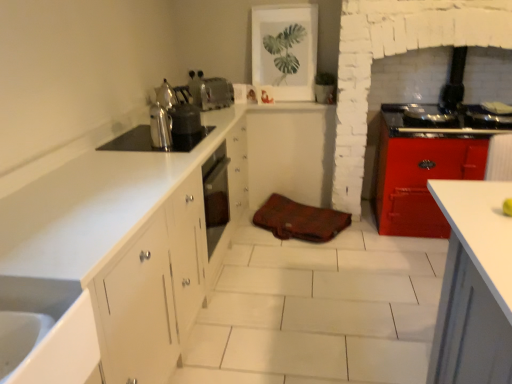
Question: Considering the positions of satin silver kettle at upper left, acting as the second appliance starting from the back, and satin silver kettle at upper left, the third appliance in the back-to-front sequence, in the image, is satin silver kettle at upper left, acting as the second appliance starting from the back, taller or shorter than satin silver kettle at upper left, the third appliance in the back-to-front sequence,?

Choices:
 (A) short
 (B) tall

Answer: (B)

Question: Looking at the image, does satin silver kettle at upper left, acting as the second appliance starting from the back, seem bigger or smaller compared to satin silver kettle at upper left, the third appliance in the back-to-front sequence?

Choices:
 (A) small
 (B) big

Answer: (B)

Question: Which of these objects is positioned farthest from the white matte cabinet at center?

Choices:
 (A) brown leather bag at center
 (B) shiny metallic tea pot at upper left
 (C) satin silver kettle at upper left, acting as the second appliance starting from the back
 (D) satin silver toaster at upper center, the 3th appliance from the front
 (E) satin silver kettle at upper left, the 1th appliance in the front-to-back sequence

Answer: (E)

Question: Based on their relative distances, which object is nearer to the satin silver toaster at upper center, the 3th appliance from the front?

Choices:
 (A) white matte cabinet at center
 (B) shiny metallic tea pot at upper left
 (C) satin silver kettle at upper left, acting as the second appliance starting from the back
 (D) satin silver kettle at upper left, the third appliance in the back-to-front sequence
 (E) brown leather bag at center

Answer: (C)